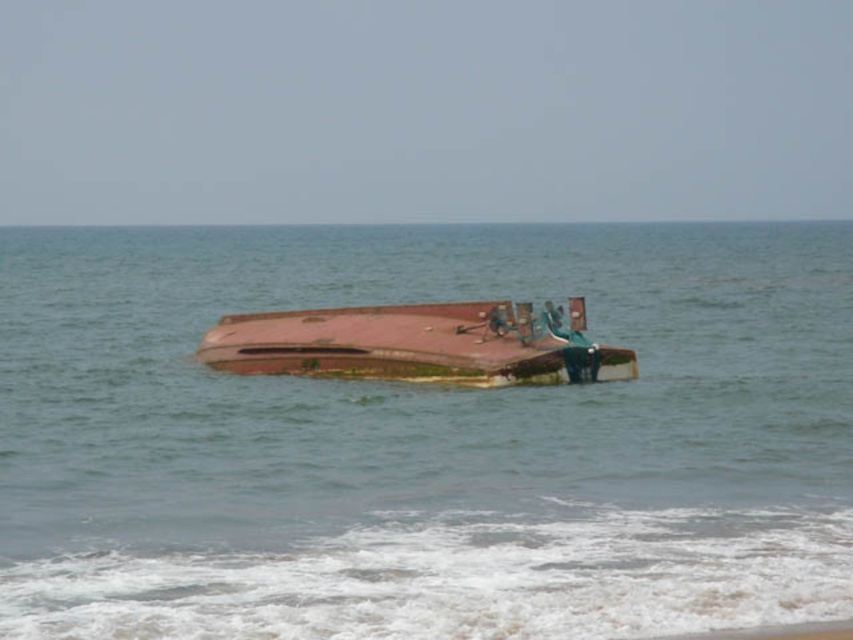
You are a marine biologist studying the area around the rusty metal boat at center. You notice the green algae water at center. Which one has a greater width in this scene?

The green algae water at center has a greater width than the rusty metal boat at center, as stated in the description.

You are a marine biologist observing the scene from a boat. You notice the green algae water at center and the rusty metal boat at center. Which object is closer to your observation point?

The green algae water at center is in front of the rusty metal boat at center, so it is closer to your observation point.

You are a marine biologist studying the distribution of algae in the ocean. You have a drone that can collect water samples at specific coordinates. The coordinates are given as a decimal between 0 and 1, where 0 is the bottom left corner of the image and 1 is the top right corner. You want to collect a sample from the green algae water at center. What coordinates should you input into the drone to collect the sample?

The coordinates for the green algae water at center are at point 0.688 on the x axis and 0.497 on the y axis. So you should input the coordinates (422, 440) into the drone to collect the sample.